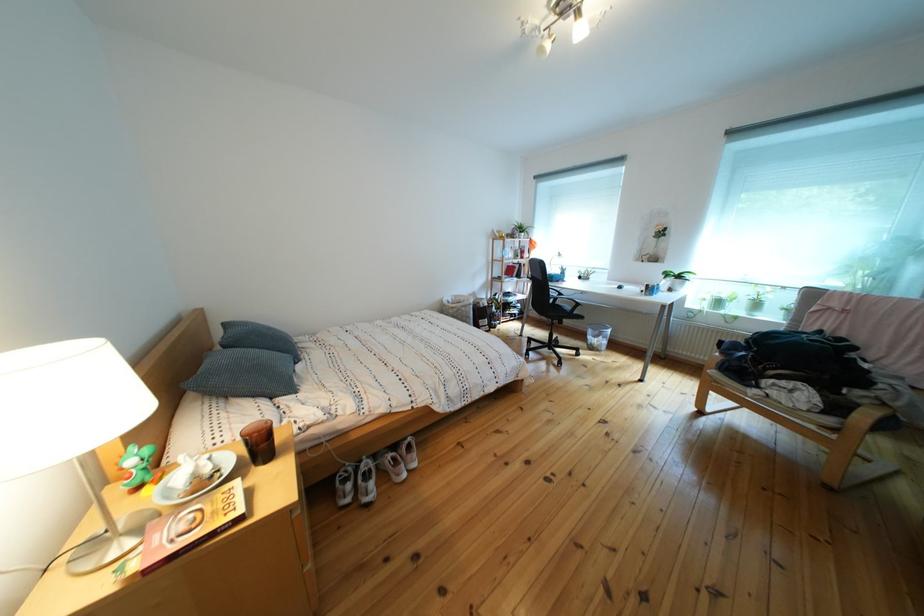
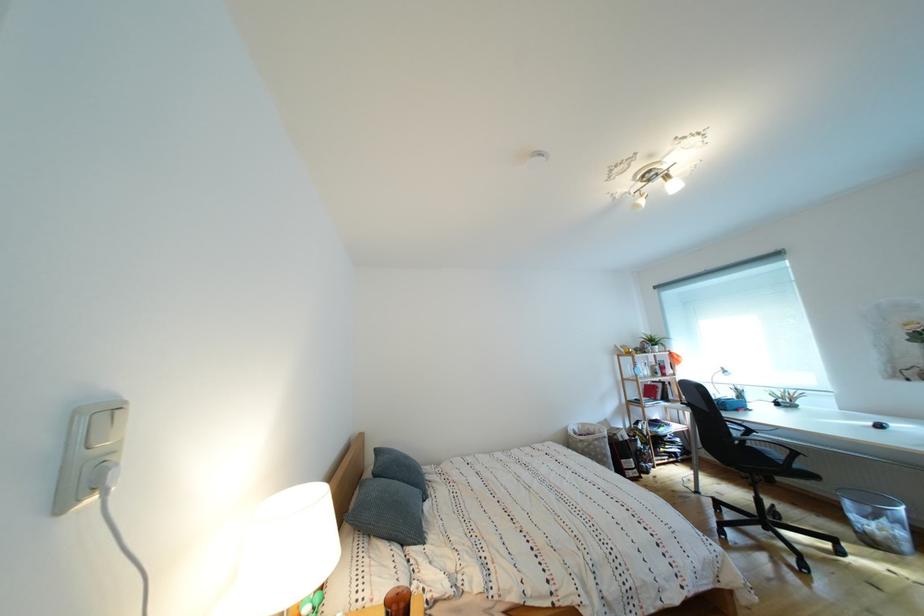
Where in the second image is the point corresponding to pixel 289 392 from the first image?

(420, 536)